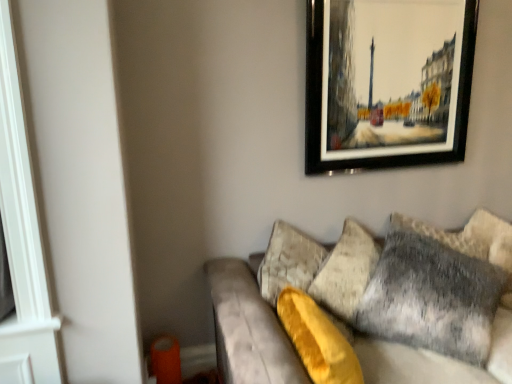
Question: Looking at the image, does gray furry pillow at right seem bigger or smaller compared to velvet gray couch at lower right?

Choices:
 (A) small
 (B) big

Answer: (A)

Question: Is gray furry pillow at right spatially inside velvet gray couch at lower right, or outside of it?

Choices:
 (A) outside
 (B) inside

Answer: (B)

Question: Considering the real-world distances, which object is closest to the gray furry pillow at right?

Choices:
 (A) velvet gray couch at lower right
 (B) black-framed painting at upper right

Answer: (A)

Question: Which object is the closest to the gray furry pillow at right?

Choices:
 (A) velvet gray couch at lower right
 (B) black-framed painting at upper right

Answer: (A)